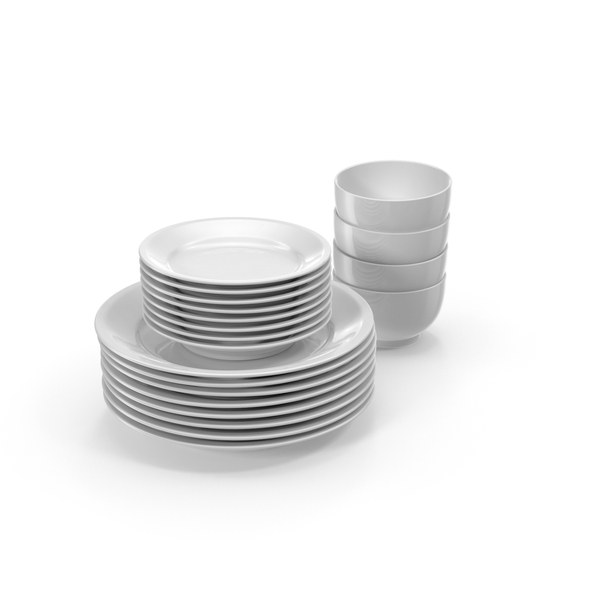
Locate an element on the screen. large plates is located at coordinates (241, 374), (241, 384), (243, 391), (240, 405), (241, 414), (243, 426), (245, 435), (248, 444).